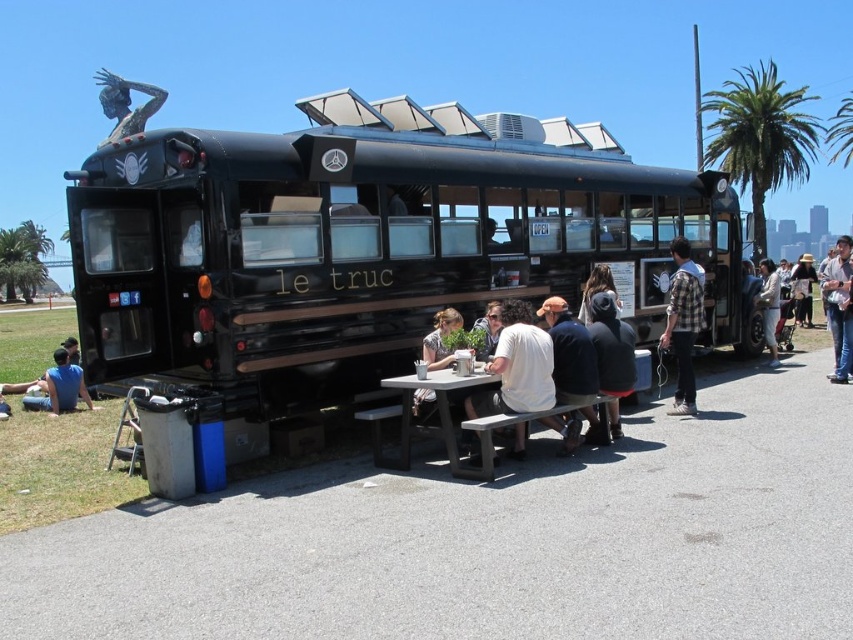
Who is taller, black hoodie at center or denim jacket at lower right?

denim jacket at lower right

Does point (614, 321) lie behind point (809, 300)?

That is False.

The width and height of the screenshot is (853, 640). In order to click on black hoodie at center in this screenshot , I will do click(612, 355).

Does denim jacket at lower right appear over matte black hoodie at center?

Indeed, denim jacket at lower right is positioned over matte black hoodie at center.

The width and height of the screenshot is (853, 640). What are the coordinates of `denim jacket at lower right` in the screenshot? It's located at (802, 289).

What are the coordinates of `denim jacket at lower right` in the screenshot? It's located at (802, 289).

At what (x,y) coordinates should I click in order to perform the action: click on denim jacket at lower right. Please return your answer as a coordinate pair (x, y). Looking at the image, I should click on (802, 289).

Between green leafy palm tree at upper right and matte black hoodie at center, which one has less height?

matte black hoodie at center is shorter.

Does green leafy palm tree at upper right have a greater height compared to matte black hoodie at center?

Correct, green leafy palm tree at upper right is much taller as matte black hoodie at center.

Where is `green leafy palm tree at upper right`? green leafy palm tree at upper right is located at coordinates point(759,136).

In order to click on green leafy palm tree at upper right in this screenshot , I will do (759, 136).